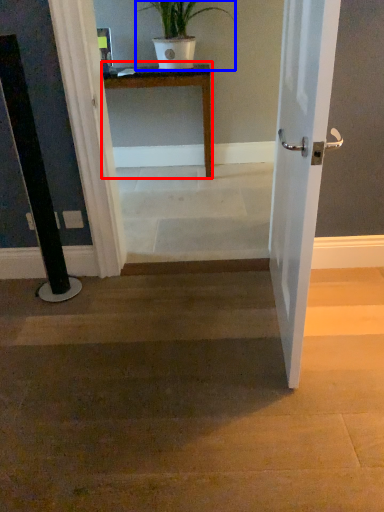
Question: Which object is closer to the camera taking this photo, table (highlighted by a red box) or houseplant (highlighted by a blue box)?

Choices:
 (A) table
 (B) houseplant

Answer: (B)